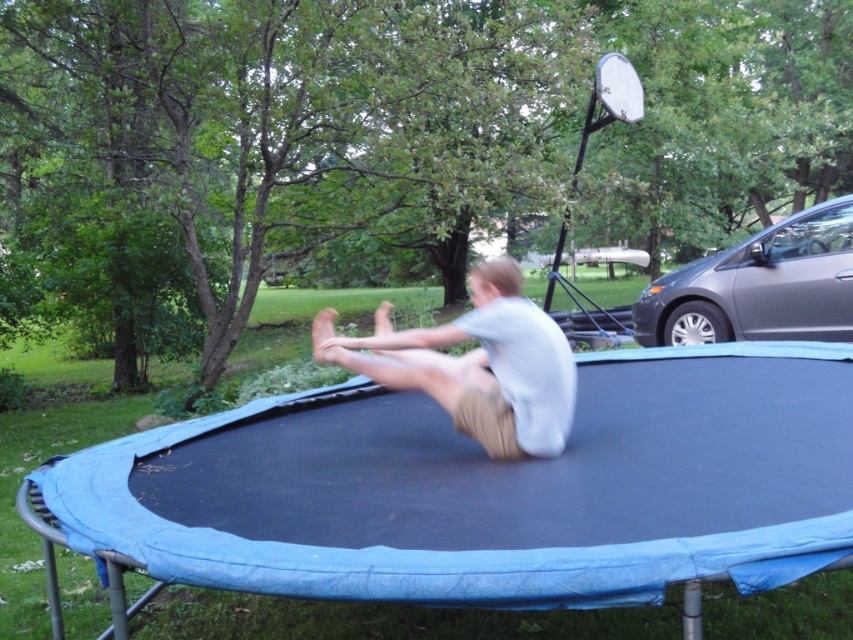
Consider the image. Can you confirm if light gray cotton shirt at center is taller than white glossy basketball hoop at upper right?

Yes, light gray cotton shirt at center is taller than white glossy basketball hoop at upper right.

The width and height of the screenshot is (853, 640). In order to click on light gray cotton shirt at center in this screenshot , I will do `click(480, 365)`.

What do you see at coordinates (480, 365) in the screenshot? Image resolution: width=853 pixels, height=640 pixels. I see `light gray cotton shirt at center` at bounding box center [480, 365].

This screenshot has height=640, width=853. I want to click on light gray cotton shirt at center, so click(480, 365).